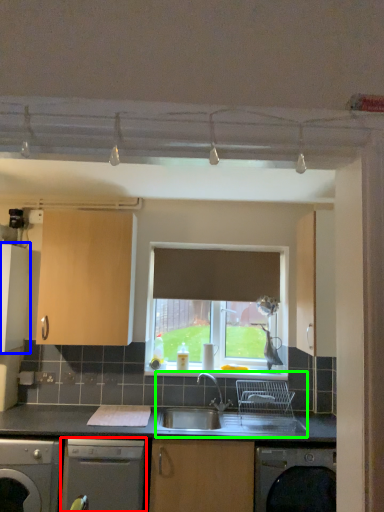
Question: Which is farther away from dishwasher (highlighted by a red box)? cabinetry (highlighted by a blue box) or sink (highlighted by a green box)?

Choices:
 (A) cabinetry
 (B) sink

Answer: (A)